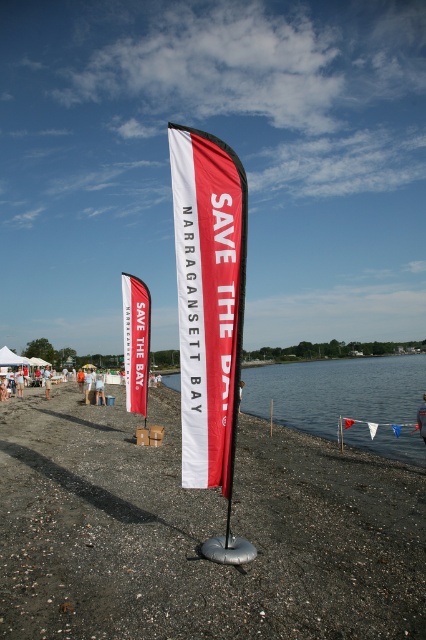
Between red/white fabric flag at center and transparent water at lower center, which one is positioned higher?

Positioned higher is red/white fabric flag at center.

From the picture: Who is more forward, (241, 288) or (293, 376)?

Point (241, 288) is more forward.

Does point (233, 278) come closer to viewer compared to point (250, 381)?

That is True.

Locate an element on the screen. The height and width of the screenshot is (640, 426). red/white fabric flag at center is located at coordinates (207, 298).

In the scene shown: Is black gravel sand at center positioned behind red/white fabric flag at center?

No.

Can you confirm if black gravel sand at center is positioned to the right of red/white fabric flag at center?

Incorrect, black gravel sand at center is not on the right side of red/white fabric flag at center.

What do you see at coordinates (198, 531) in the screenshot?
I see `black gravel sand at center` at bounding box center [198, 531].

Where is `black gravel sand at center`? The height and width of the screenshot is (640, 426). black gravel sand at center is located at coordinates (198, 531).

Can you confirm if black gravel sand at center is thinner than transparent water at lower center?

Indeed, black gravel sand at center has a lesser width compared to transparent water at lower center.

Does black gravel sand at center have a larger size compared to transparent water at lower center?

Actually, black gravel sand at center might be smaller than transparent water at lower center.

Who is more distant from viewer, (3, 456) or (313, 372)?

Point (313, 372)

Locate an element on the screen. black gravel sand at center is located at coordinates (198, 531).